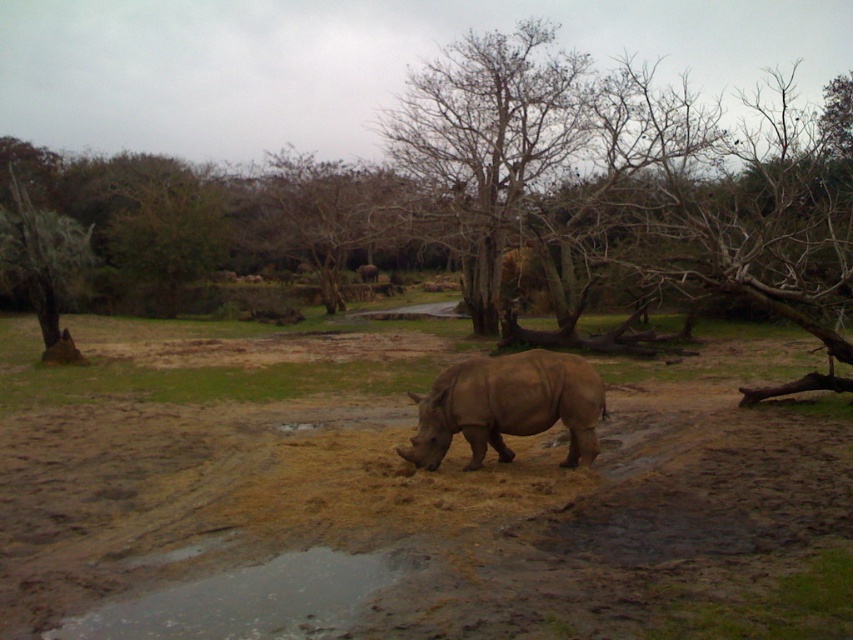
Question: Where is brown wood tree at center located in relation to reflective wet mud at lower center in the image?

Choices:
 (A) left
 (B) right

Answer: (A)

Question: Is brown wood tree at center wider than light brown textured rhino at center?

Choices:
 (A) yes
 (B) no

Answer: (A)

Question: Which point is closer to the camera taking this photo?

Choices:
 (A) (610, 518)
 (B) (78, 636)

Answer: (B)

Question: Which object is farther from the camera taking this photo?

Choices:
 (A) reflective wet mud at lower center
 (B) brown wood tree at center
 (C) brown sandy dirt at center
 (D) bare wood tree at center

Answer: (B)

Question: In this image, where is brown sandy dirt at center located relative to brown wood tree at center?

Choices:
 (A) right
 (B) left

Answer: (A)

Question: Which of the following is the closest to the observer?

Choices:
 (A) (770, 627)
 (B) (244, 593)

Answer: (A)